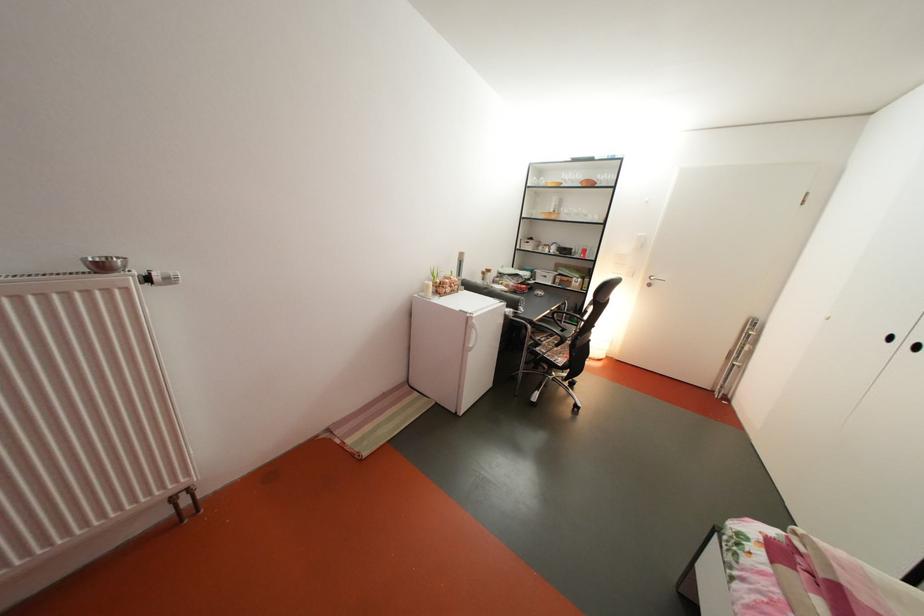
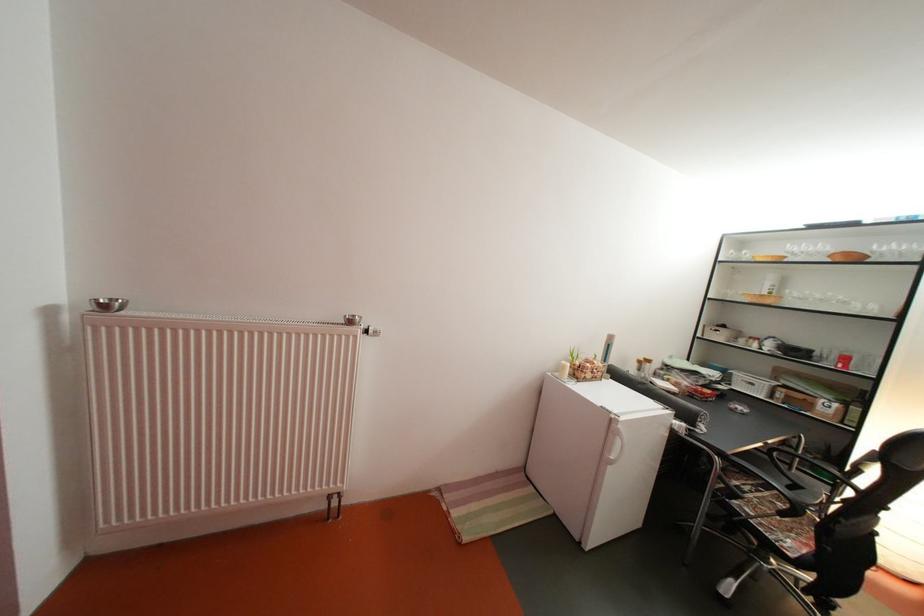
Question: The camera is either moving clockwise (left) or counter-clockwise (right) around the object. The first image is from the beginning of the video and the second image is from the end. Is the camera moving left or right when shooting the video?

Choices:
 (A) Left
 (B) Right

Answer: (B)